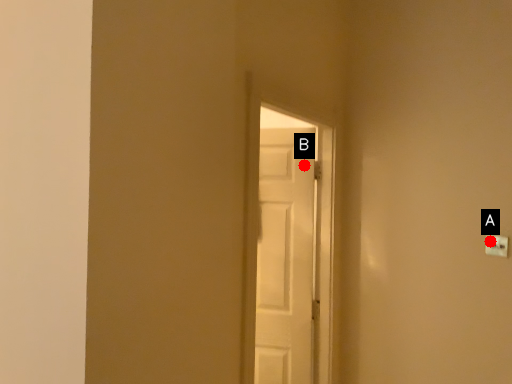
Question: Two points are circled on the image, labeled by A and B beside each circle. Which point appears farthest from the camera in this image?

Choices:
 (A) A is further
 (B) B is further

Answer: (B)